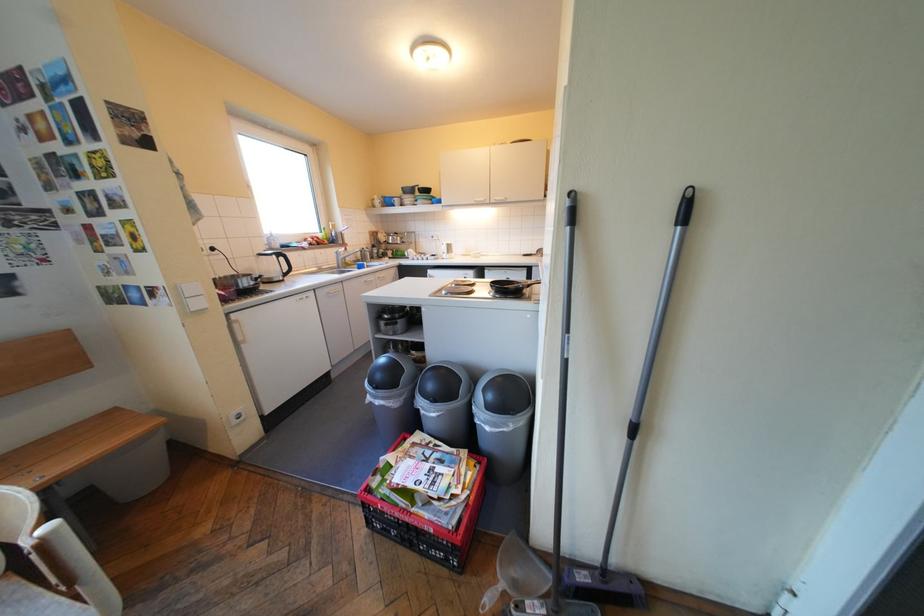
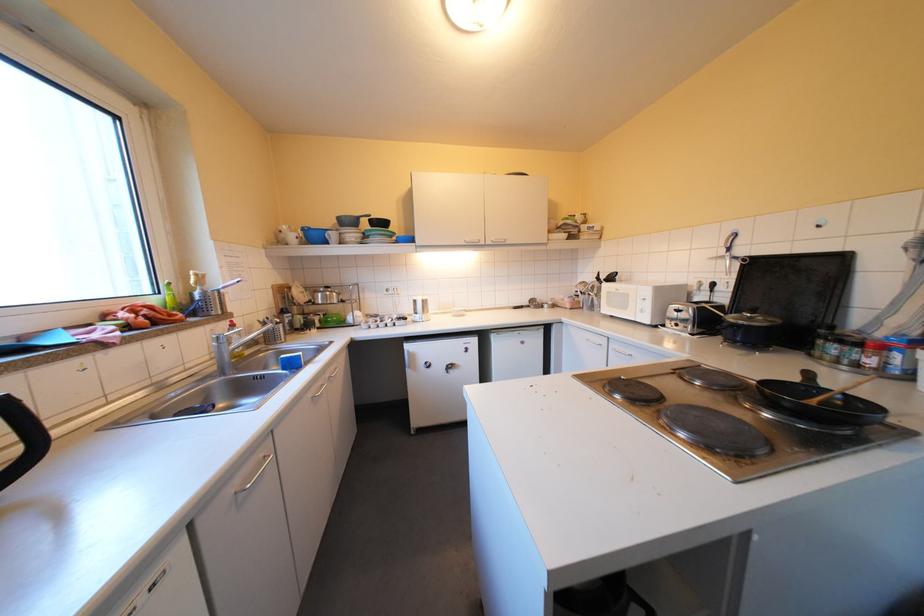
In the second image, find the point that corresponds to point 391,201 in the first image.

(305, 236)